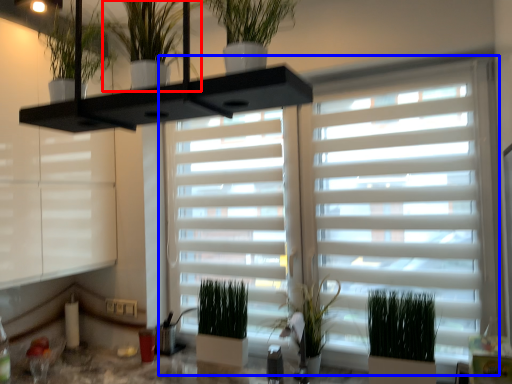
Question: Among these objects, which one is farthest to the camera, houseplant (highlighted by a red box) or window blind (highlighted by a blue box)?

Choices:
 (A) houseplant
 (B) window blind

Answer: (B)